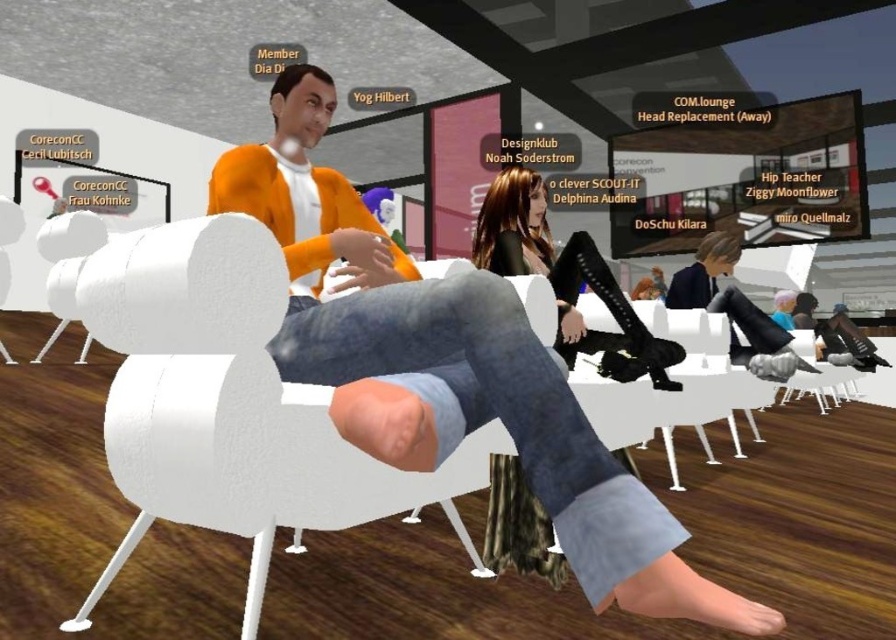
Does point (240, 480) come behind point (536, 273)?

No, it is in front of (536, 273).

In the scene shown: Which is more to the left, white matte chair at center or shiny black leggings at center?

white matte chair at center

Is point (220, 275) closer to viewer compared to point (622, 320)?

Yes, point (220, 275) is closer to viewer.

Image resolution: width=896 pixels, height=640 pixels. Identify the location of white matte chair at center. pos(229,406).

Does orange cotton sweater at center appear on the left side of white matte chair at center?

No, orange cotton sweater at center is not to the left of white matte chair at center.

At what (x,y) coordinates should I click in order to perform the action: click on orange cotton sweater at center. Please return your answer as a coordinate pair (x, y). The width and height of the screenshot is (896, 640). Looking at the image, I should click on (449, 368).

Locate an element on the screen. This screenshot has width=896, height=640. orange cotton sweater at center is located at coordinates (449, 368).

Can you confirm if orange cotton sweater at center is positioned above shiny black leggings at center?

No, orange cotton sweater at center is not above shiny black leggings at center.

Between orange cotton sweater at center and shiny black leggings at center, which one has less height?

shiny black leggings at center

Image resolution: width=896 pixels, height=640 pixels. Identify the location of orange cotton sweater at center. (449, 368).